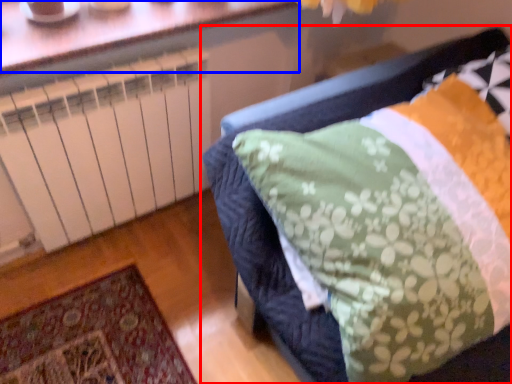
Question: Which object is further to the camera taking this photo, furniture (highlighted by a red box) or window (highlighted by a blue box)?

Choices:
 (A) furniture
 (B) window

Answer: (B)